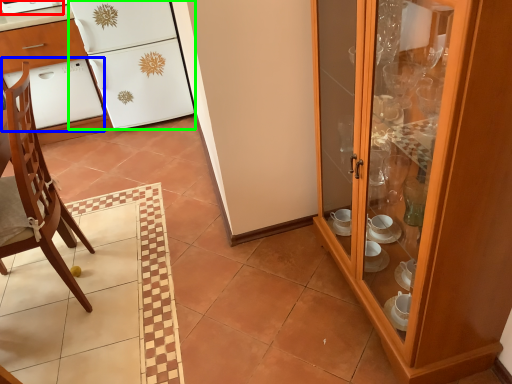
Question: Estimate the real-world distances between objects in this image. Which object is farther from appliance (highlighted by a red box), oven (highlighted by a blue box) or refrigerator (highlighted by a green box)?

Choices:
 (A) oven
 (B) refrigerator

Answer: (B)